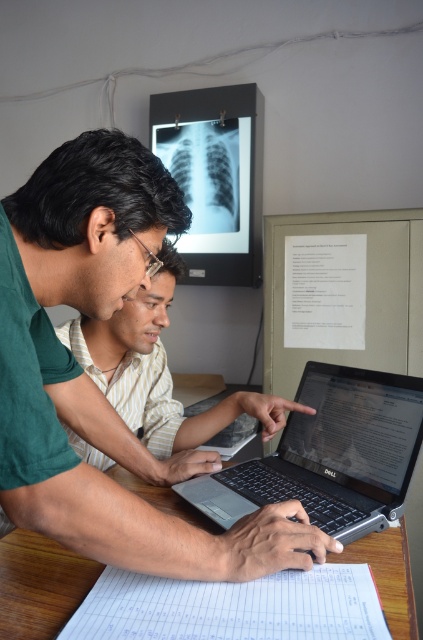
In order to click on matte green shirt at center in this screenshot , I will do `click(156, 371)`.

Can you confirm if matte green shirt at center is shorter than white paper at lower center?

In fact, matte green shirt at center may be taller than white paper at lower center.

Is point (129, 301) less distant than point (52, 600)?

No, it is not.

The height and width of the screenshot is (640, 423). I want to click on matte green shirt at center, so click(x=156, y=371).

Which is in front, point (8, 282) or point (406, 560)?

Point (8, 282) is more forward.

Which of these two, green matte shirt at upper left or white paper at lower center, stands shorter?

With less height is white paper at lower center.

Is point (11, 305) closer to viewer compared to point (378, 588)?

Yes, it is in front of point (378, 588).

The image size is (423, 640). I want to click on green matte shirt at upper left, so click(x=91, y=380).

Looking at this image, who is lower down, green matte shirt at upper left or satin black laptop at center?

satin black laptop at center is lower down.

Is green matte shirt at upper left in front of satin black laptop at center?

Yes, green matte shirt at upper left is closer to the viewer.

Identify the location of green matte shirt at upper left. This screenshot has height=640, width=423. (91, 380).

Find the location of `green matte shirt at upper left`. green matte shirt at upper left is located at coordinates 91,380.